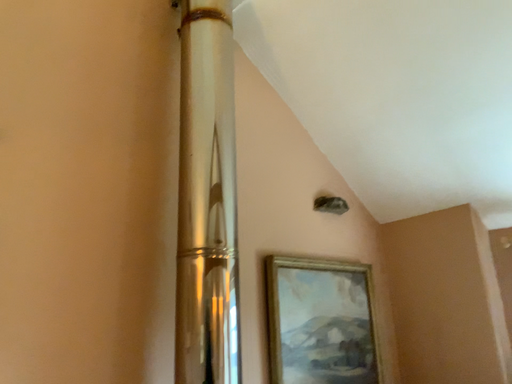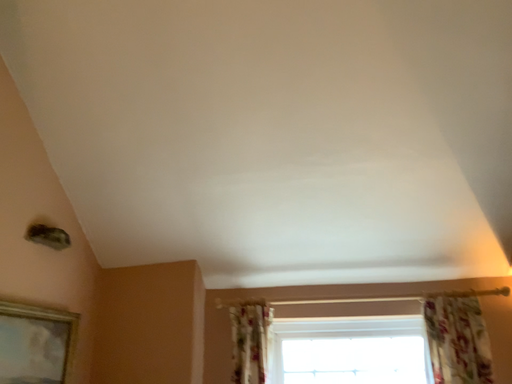
Question: Which way did the camera rotate in the video?

Choices:
 (A) rotated right
 (B) rotated left

Answer: (A)